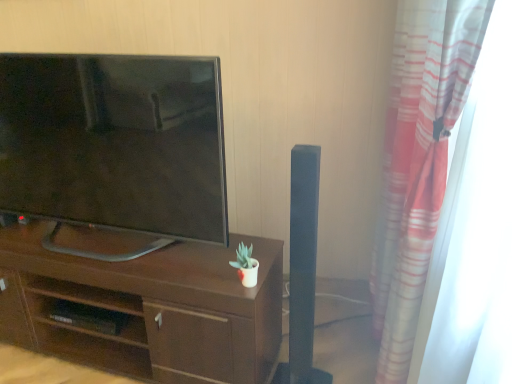
Question: Would you say striped fabric curtain at right is outside matte black tv at left?

Choices:
 (A) yes
 (B) no

Answer: (A)

Question: Does striped fabric curtain at right come in front of matte black tv at left?

Choices:
 (A) no
 (B) yes

Answer: (B)

Question: From a real-world perspective, is striped fabric curtain at right positioned over matte black tv at left based on gravity?

Choices:
 (A) yes
 (B) no

Answer: (B)

Question: Is there a large distance between striped fabric curtain at right and matte black tv at left?

Choices:
 (A) no
 (B) yes

Answer: (B)

Question: From the image's perspective, is striped fabric curtain at right over matte black tv at left?

Choices:
 (A) no
 (B) yes

Answer: (A)

Question: Is striped fabric curtain at right situated inside matte black tv at left or outside?

Choices:
 (A) inside
 (B) outside

Answer: (B)

Question: From a real-world perspective, relative to matte black tv at left, is striped fabric curtain at right vertically above or below?

Choices:
 (A) below
 (B) above

Answer: (A)

Question: In the image, is striped fabric curtain at right positioned in front of or behind matte black tv at left?

Choices:
 (A) behind
 (B) front

Answer: (B)

Question: From the image's perspective, relative to matte black tv at left, is striped fabric curtain at right above or below?

Choices:
 (A) below
 (B) above

Answer: (A)

Question: Do you think dark wood desk at center is within matte black tv at left, or outside of it?

Choices:
 (A) inside
 (B) outside

Answer: (B)

Question: In the image, is dark wood desk at center on the left side or the right side of matte black tv at left?

Choices:
 (A) left
 (B) right

Answer: (B)

Question: Considering their positions, is dark wood desk at center located in front of or behind matte black tv at left?

Choices:
 (A) front
 (B) behind

Answer: (B)

Question: In terms of height, does dark wood desk at center look taller or shorter compared to matte black tv at left?

Choices:
 (A) short
 (B) tall

Answer: (A)

Question: From a real-world perspective, is striped fabric curtain at right physically located above or below dark wood desk at center?

Choices:
 (A) above
 (B) below

Answer: (A)

Question: From the image's perspective, relative to dark wood desk at center, is striped fabric curtain at right above or below?

Choices:
 (A) above
 (B) below

Answer: (A)